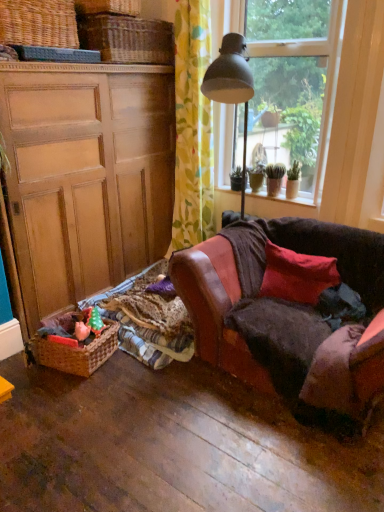
Locate an element on the screen. Image resolution: width=384 pixels, height=512 pixels. empty space that is ontop of smooth concrete window sill at center (from a real-world perspective) is located at coordinates (266, 194).